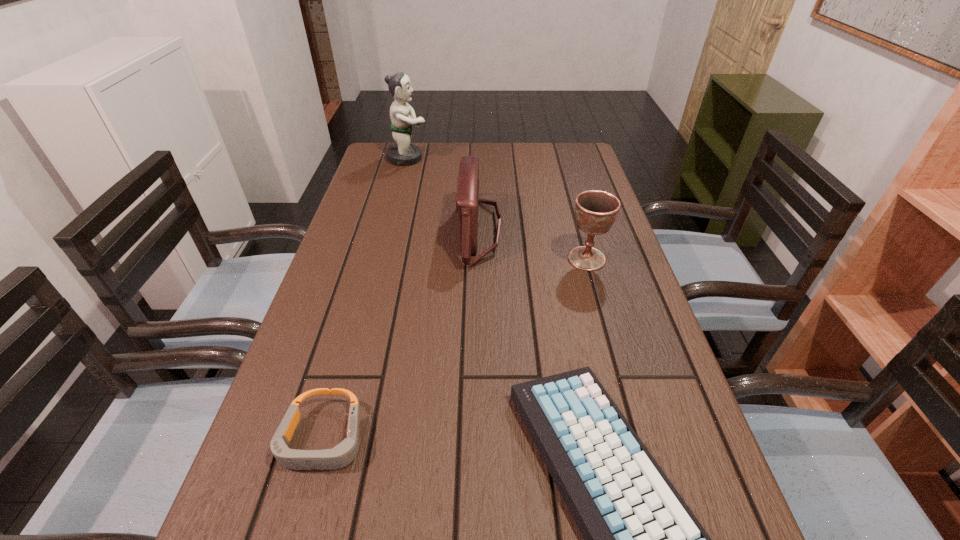
Identify the location of the farthest object. This screenshot has height=540, width=960. (402, 153).

Locate an element on the screen. The image size is (960, 540). the tallest object is located at coordinates (402, 153).

Where is `chalice`? chalice is located at coordinates (596, 211).

Locate an element on the screen. The height and width of the screenshot is (540, 960). shoulder bag is located at coordinates (467, 200).

The image size is (960, 540). What are the coordinates of `goggles` in the screenshot? It's located at (344, 453).

I want to click on free spot located 0.360m on the front-facing side of the farthest object, so click(x=535, y=158).

Find the location of `free space located 0.320m on the left of the chalice`. free space located 0.320m on the left of the chalice is located at coordinates (437, 259).

At what (x,y) coordinates should I click in order to perform the action: click on free space located 0.090m on the front flap of the shoulder bag. Please return your answer as a coordinate pair (x, y). The height and width of the screenshot is (540, 960). Looking at the image, I should click on (424, 230).

The image size is (960, 540). In order to click on vacant space positioned on the front flap of the shoulder bag in this screenshot , I will do [391, 230].

Where is `vacant point located 0.080m on the front flap of the shoulder bag`? The image size is (960, 540). vacant point located 0.080m on the front flap of the shoulder bag is located at coordinates (428, 230).